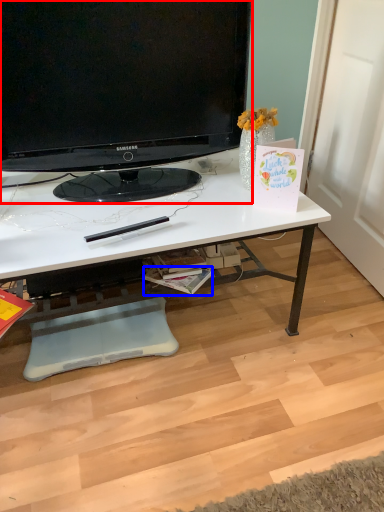
Question: Which object appears closest to the camera in this image, television (highlighted by a red box) or magazine (highlighted by a blue box)?

Choices:
 (A) television
 (B) magazine

Answer: (A)